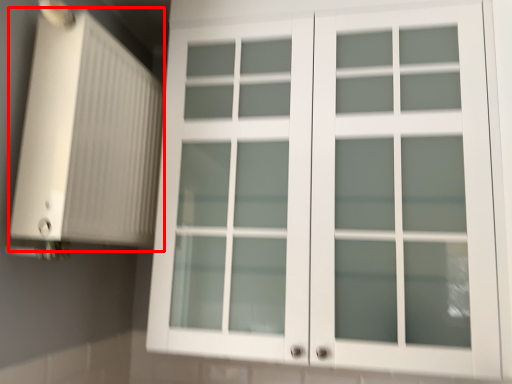
Question: Considering the relative positions of air conditioning (annotated by the red box) and cupboard in the image provided, where is air conditioning (annotated by the red box) located with respect to the staircase?

Choices:
 (A) left
 (B) right

Answer: (A)